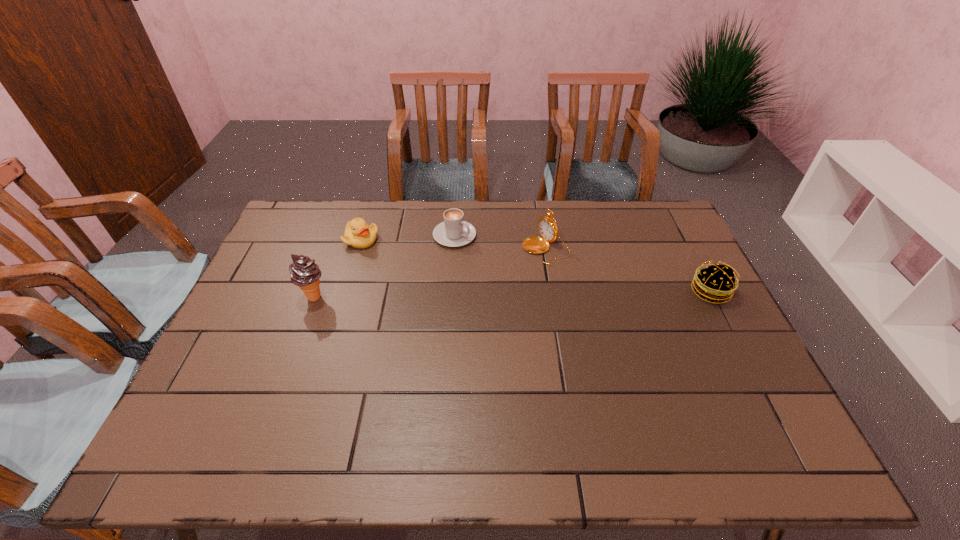
You are a GUI agent. You are given a task and a screenshot of the screen. Output one action in this format:
    pyautogui.click(x=<x>, y=<y>)
    Task: Click on the icecream
    Image resolution: width=960 pixels, height=540 pixels.
    Given the screenshot: What is the action you would take?
    pyautogui.click(x=304, y=273)

Locate an element on the screen. patty is located at coordinates (714, 282).

I want to click on cappuccino, so click(454, 231).

Identify the location of the fourth object from left to right. The width and height of the screenshot is (960, 540). (548, 228).

Where is `the fourth shortest object`? The image size is (960, 540). the fourth shortest object is located at coordinates (548, 228).

Where is `duckling`? The height and width of the screenshot is (540, 960). duckling is located at coordinates (358, 234).

The width and height of the screenshot is (960, 540). In order to click on blank area located on the front of the tallest object in this screenshot , I will do `click(293, 355)`.

This screenshot has height=540, width=960. Find the location of `vacant region located on the front of the patty`. vacant region located on the front of the patty is located at coordinates (753, 374).

The image size is (960, 540). What are the coordinates of `vacant space located to the right of the cappuccino` in the screenshot? It's located at (554, 290).

Find the location of a particular element. The height and width of the screenshot is (540, 960). vacant space located 0.370m to the right of the cappuccino is located at coordinates (565, 296).